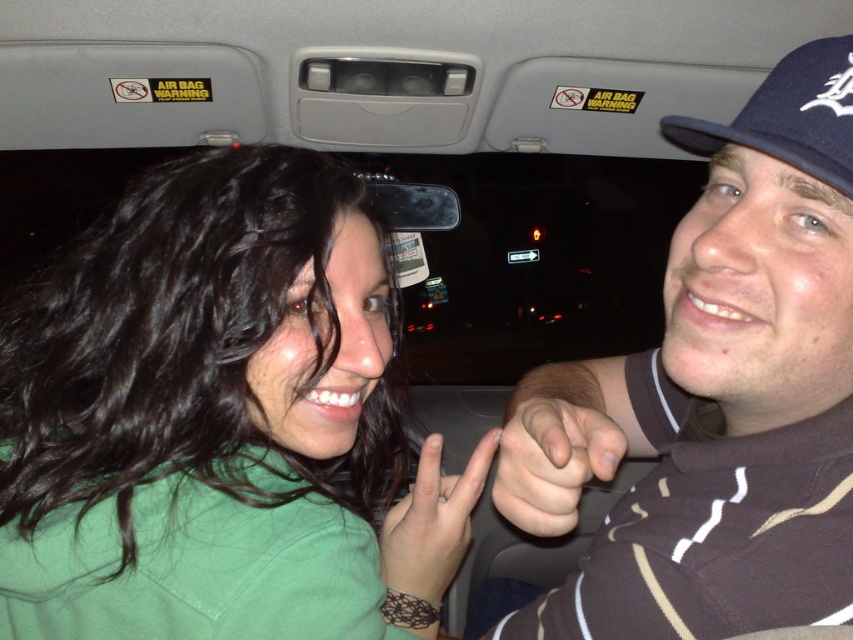
Question: Does green matte shirt at upper left lie behind blue fabric baseball cap at upper right?

Choices:
 (A) yes
 (B) no

Answer: (A)

Question: Which point is closer to the camera?

Choices:
 (A) blue fabric baseball cap at upper right
 (B) green matte hand at center

Answer: (A)

Question: Can you confirm if smooth skin hand at center is thinner than blue fabric baseball cap at upper right?

Choices:
 (A) yes
 (B) no

Answer: (B)

Question: Is brown striped shirt at right to the right of green matte hand at center from the viewer's perspective?

Choices:
 (A) yes
 (B) no

Answer: (A)

Question: Which point appears farthest from the camera in this image?

Choices:
 (A) (467, 486)
 (B) (827, 163)
 (C) (775, 172)
 (D) (585, 412)

Answer: (A)

Question: Which is farther from the blue fabric baseball cap at upper right?

Choices:
 (A) green matte shirt at upper left
 (B) brown striped shirt at right
 (C) green matte hand at center
 (D) smooth skin hand at center

Answer: (A)